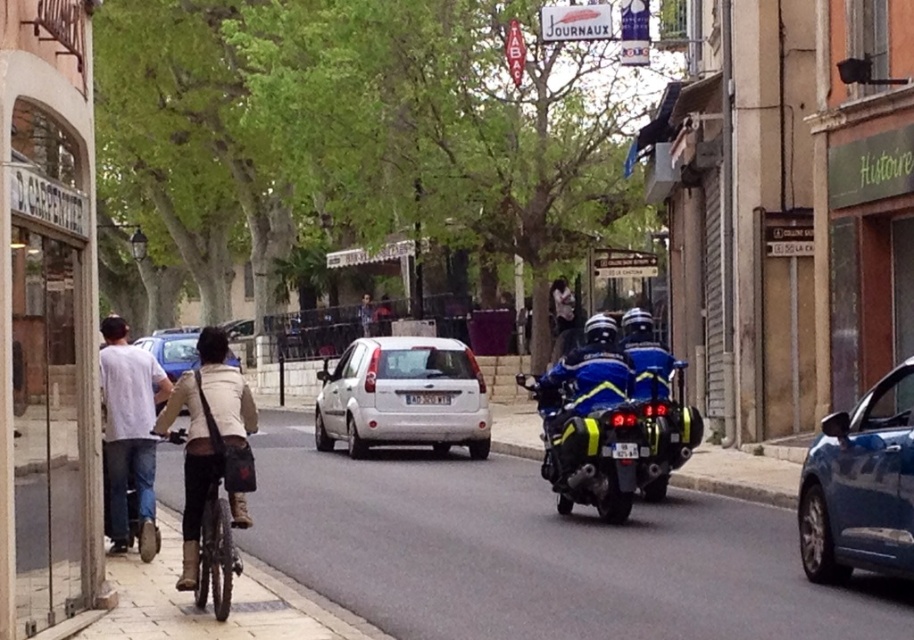
Who is shorter, blue metallic car at right or blue glossy motorcycle at center?

blue glossy motorcycle at center

The image size is (914, 640). Find the location of `blue metallic car at right`. blue metallic car at right is located at coordinates (859, 486).

The image size is (914, 640). I want to click on blue metallic car at right, so click(859, 486).

Which is more to the left, smooth concrete sidewalk at lower left or white cotton shirt at left?

white cotton shirt at left

Is smooth concrete sidewalk at lower left taller than white cotton shirt at left?

No, smooth concrete sidewalk at lower left is not taller than white cotton shirt at left.

Identify the location of smooth concrete sidewalk at lower left. (537, 554).

I want to click on smooth concrete sidewalk at lower left, so click(x=537, y=554).

Does point (816, 560) lie behind point (470, 371)?

No, it is not.

Who is positioned more to the right, blue metallic car at right or white matte hatchback at center?

Positioned to the right is blue metallic car at right.

Between point (861, 465) and point (380, 403), which one is positioned behind?

Positioned behind is point (380, 403).

Where is `blue metallic car at right`? The width and height of the screenshot is (914, 640). blue metallic car at right is located at coordinates (859, 486).